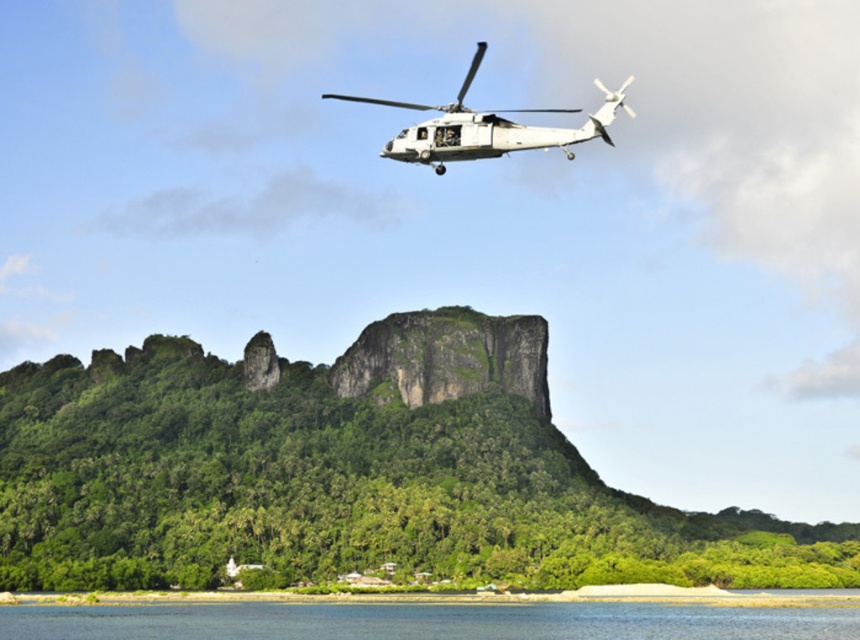
You are standing at the point labeled as point [427,620] in the image. What do you see directly below you?

The point labeled as point [427,620] indicates blue water at lower center, so you see blue water directly below you.

You are standing at the edge of the blue water at lower center and want to take a photo of the green leafy mountain at center. In which direction should you point your camera to capture the mountain in your shot?

You should point your camera to the left to capture the green leafy mountain at center, as it is located to the left of the blue water at lower center.